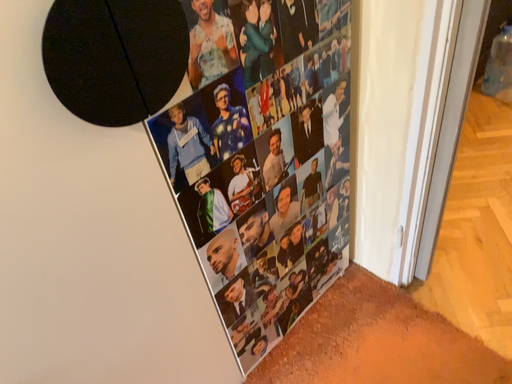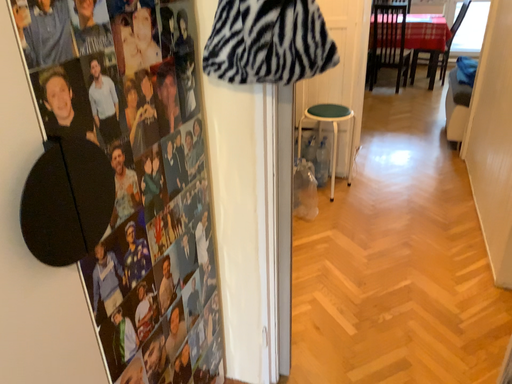
Question: How did the camera likely rotate when shooting the video?

Choices:
 (A) rotated left
 (B) rotated right

Answer: (B)